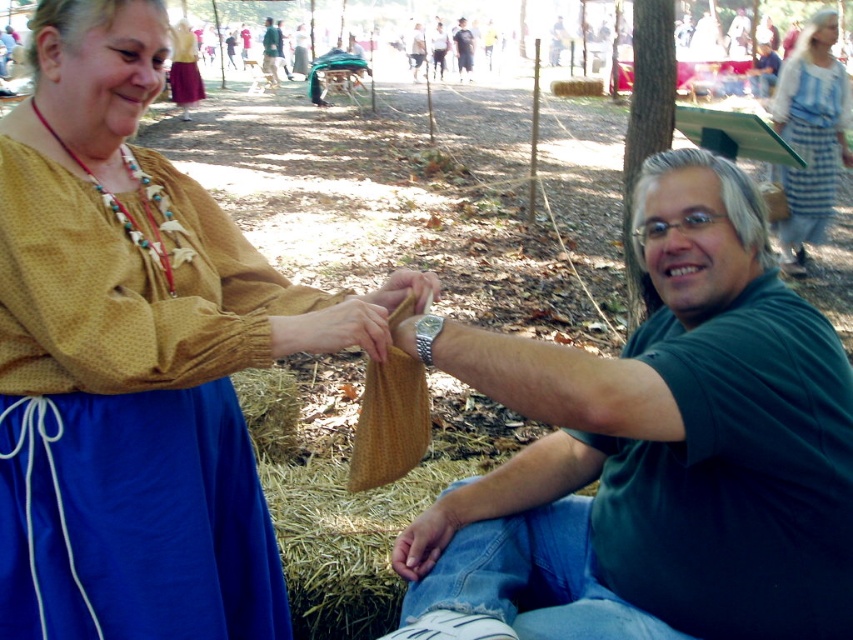
Can you confirm if matte brown bag at center is bigger than smooth brown cloth at center?

Indeed, matte brown bag at center has a larger size compared to smooth brown cloth at center.

Consider the image. Can you confirm if matte brown bag at center is positioned below smooth brown cloth at center?

Correct, matte brown bag at center is located below smooth brown cloth at center.

Does point (711, 369) lie behind point (328, 326)?

No, it is not.

This screenshot has height=640, width=853. What are the coordinates of `matte brown bag at center` in the screenshot? It's located at (654, 452).

Is matte yellow blouse at center thinner than matte yellow blouse at upper left?

No, matte yellow blouse at center is not thinner than matte yellow blouse at upper left.

Can you confirm if matte yellow blouse at center is wider than matte yellow blouse at upper left?

Yes.

Is point (42, 506) positioned behind point (181, 22)?

That is False.

Locate an element on the screen. matte yellow blouse at center is located at coordinates (125, 358).

Who is taller, matte brown bag at center or green fabric bag at center?

With more height is green fabric bag at center.

Does matte brown bag at center appear on the right side of green fabric bag at center?

Yes, matte brown bag at center is to the right of green fabric bag at center.

Describe the element at coordinates (654, 452) in the screenshot. I see `matte brown bag at center` at that location.

Where is `matte brown bag at center`? The height and width of the screenshot is (640, 853). matte brown bag at center is located at coordinates (654, 452).